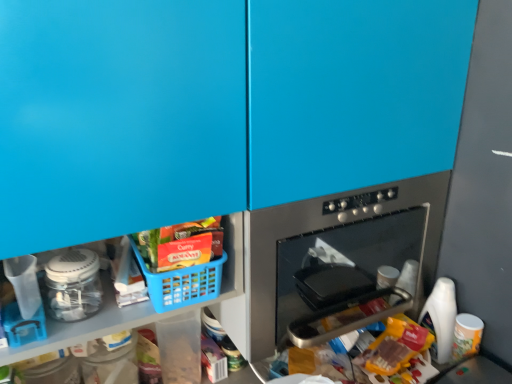
What are the coordinates of `blue plastic basket at lower left` in the screenshot? It's located at [x=181, y=283].

Identify the location of clear plastic jar at lower left. (73, 285).

How much space does translucent plastic bag at lower center, acting as the first food starting from the right, occupy vertically?

translucent plastic bag at lower center, acting as the first food starting from the right, is 24.14 centimeters in height.

Locate an element on the screen. white plastic bottle at lower right is located at coordinates (440, 318).

The height and width of the screenshot is (384, 512). What are the coordinates of `matte plastic basket at lower center, which appears as the second food when ordered from the bottom` in the screenshot? It's located at point(181,244).

What do you see at coordinates (338, 245) in the screenshot? This screenshot has height=384, width=512. I see `stainless steel oven at center` at bounding box center [338, 245].

Locate an element on the screen. Image resolution: width=512 pixels, height=384 pixels. blue plastic basket at lower left is located at coordinates (181, 283).

Between clear plastic jar at lower left and stainless steel oven at center, which one is positioned behind?

stainless steel oven at center is further away from the camera.

From the image's perspective, is clear plastic jar at lower left on top of stainless steel oven at center?

No, from the image's perspective, clear plastic jar at lower left is not on top of stainless steel oven at center.

Between clear plastic jar at lower left and stainless steel oven at center, which one has larger size?

Bigger between the two is stainless steel oven at center.

Would you say clear plastic jar at lower left is to the left or to the right of stainless steel oven at center in the picture?

In the image, clear plastic jar at lower left appears on the left side of stainless steel oven at center.

Is point (67, 286) in front of point (370, 347)?

Yes, it is.

Would you say clear plastic jar at lower left is outside translucent plastic bag at lower center, the 2th food viewed from the left?

Yes, clear plastic jar at lower left is not within translucent plastic bag at lower center, the 2th food viewed from the left.

Is clear plastic jar at lower left positioned with its back to translucent plastic bag at lower center, the 2th food viewed from the left?

No, clear plastic jar at lower left's orientation is not away from translucent plastic bag at lower center, the 2th food viewed from the left.

Which of these two, clear plastic jar at lower left or translucent plastic bag at lower center, the 2th food viewed from the left, stands shorter?

With less height is clear plastic jar at lower left.

Which of these two, stainless steel oven at center or translucent plastic bag at lower center, acting as the first food starting from the right, stands shorter?

With less height is translucent plastic bag at lower center, acting as the first food starting from the right.

How different are the orientations of stainless steel oven at center and translucent plastic bag at lower center, arranged as the first food when ordered from the bottom, in degrees?

They differ by 0.785 degrees in their facing directions.

Which is in front, stainless steel oven at center or translucent plastic bag at lower center, acting as the first food starting from the right?

Positioned in front is translucent plastic bag at lower center, acting as the first food starting from the right.

From a real-world perspective, is matte plastic basket at lower center, positioned as the first food in top-to-bottom order, physically located above or below stainless steel oven at center?

matte plastic basket at lower center, positioned as the first food in top-to-bottom order, is above stainless steel oven at center.

Do you think matte plastic basket at lower center, placed as the second food when sorted from right to left, is within stainless steel oven at center, or outside of it?

The correct answer is: outside.

Is point (168, 232) positioned before point (367, 203)?

Yes.

Considering the sizes of objects matte plastic basket at lower center, which ranks as the first food in left-to-right order, and stainless steel oven at center in the image provided, who is smaller, matte plastic basket at lower center, which ranks as the first food in left-to-right order, or stainless steel oven at center?

Smaller between the two is matte plastic basket at lower center, which ranks as the first food in left-to-right order.

Does translucent plastic bag at lower center, acting as the first food starting from the right, have a lesser width compared to stainless steel oven at center?

Correct, the width of translucent plastic bag at lower center, acting as the first food starting from the right, is less than that of stainless steel oven at center.

Looking at this image, from the image's perspective, which is below, translucent plastic bag at lower center, the 2th food viewed from the left, or stainless steel oven at center?

translucent plastic bag at lower center, the 2th food viewed from the left, appears lower in the image.

How many degrees apart are the facing directions of translucent plastic bag at lower center, acting as the first food starting from the right, and stainless steel oven at center?

The angular difference between translucent plastic bag at lower center, acting as the first food starting from the right, and stainless steel oven at center is 0.785 degrees.

How different are the orientations of translucent plastic bag at lower center, arranged as the first food when ordered from the bottom, and matte plastic basket at lower center, positioned as the first food in top-to-bottom order, in degrees?

The angular difference between translucent plastic bag at lower center, arranged as the first food when ordered from the bottom, and matte plastic basket at lower center, positioned as the first food in top-to-bottom order, is 3.89 degrees.

Between translucent plastic bag at lower center, arranged as the first food when ordered from the bottom, and matte plastic basket at lower center, placed as the second food when sorted from right to left, which one has more height?

translucent plastic bag at lower center, arranged as the first food when ordered from the bottom.

How distant is translucent plastic bag at lower center, acting as the first food starting from the right, from matte plastic basket at lower center, placed as the second food when sorted from right to left?

The distance of translucent plastic bag at lower center, acting as the first food starting from the right, from matte plastic basket at lower center, placed as the second food when sorted from right to left, is 21.65 inches.

The image size is (512, 384). What are the coordinates of `food on the left of the translucent plastic bag at lower center, arranged as the first food when ordered from the bottom` in the screenshot? It's located at (181, 244).

Considering the positions of points (436, 284) and (178, 297), is point (436, 284) closer to camera compared to point (178, 297)?

That is False.

Is blue plastic basket at lower left surrounded by white plastic bottle at lower right?

No, blue plastic basket at lower left is not a part of white plastic bottle at lower right.

Between white plastic bottle at lower right and blue plastic basket at lower left, which one is positioned in front?

blue plastic basket at lower left is closer to the camera.

Is white plastic bottle at lower right thinner than blue plastic basket at lower left?

Yes.

Where is `home appliance on the right of clear plastic jar at lower left`? home appliance on the right of clear plastic jar at lower left is located at coordinates (338, 245).

At what (x,y) coordinates should I click in order to perform the action: click on appliance to the left of translucent plastic bag at lower center, the second food in the top-to-bottom sequence. Please return your answer as a coordinate pair (x, y). The width and height of the screenshot is (512, 384). Looking at the image, I should click on (73, 285).

From the image, which object appears to be nearer to stainless steel oven at center, clear plastic jar at lower left or blue plastic basket at lower left?

Among the two, blue plastic basket at lower left is located nearer to stainless steel oven at center.

Based on their spatial positions, is clear plastic jar at lower left or blue plastic basket at lower left closer to white plastic bottle at lower right?

blue plastic basket at lower left.

Looking at the image, which one is located further to translucent plastic bag at lower center, acting as the first food starting from the right, matte plastic basket at lower center, positioned as the first food in top-to-bottom order, or stainless steel oven at center?

The object further to translucent plastic bag at lower center, acting as the first food starting from the right, is matte plastic basket at lower center, positioned as the first food in top-to-bottom order.

In the scene shown: Based on their spatial positions, is matte plastic basket at lower center, which appears as the second food when ordered from the bottom, or blue plastic basket at lower left closer to clear plastic jar at lower left?

blue plastic basket at lower left is positioned closer to the anchor clear plastic jar at lower left.

Considering their positions, is clear plastic jar at lower left positioned further to translucent plastic bag at lower center, the 2th food viewed from the left, than blue plastic basket at lower left?

clear plastic jar at lower left is positioned further to the anchor translucent plastic bag at lower center, the 2th food viewed from the left.

Looking at the image, which one is located further to clear plastic jar at lower left, stainless steel oven at center or translucent plastic bag at lower center, the second food in the top-to-bottom sequence?

stainless steel oven at center lies further to clear plastic jar at lower left than the other object.

When comparing their distances from white plastic bottle at lower right, does blue plastic basket at lower left or clear plastic jar at lower left seem closer?

blue plastic basket at lower left lies closer to white plastic bottle at lower right than the other object.

From the image, which object appears to be nearer to clear plastic jar at lower left, white plastic bottle at lower right or translucent plastic bag at lower center, the 2th food viewed from the left?

Based on the image, translucent plastic bag at lower center, the 2th food viewed from the left, appears to be nearer to clear plastic jar at lower left.

Where is `basket that lies between matte plastic basket at lower center, positioned as the first food in top-to-bottom order, and translucent plastic bag at lower center, acting as the first food starting from the right, from top to bottom`? The image size is (512, 384). basket that lies between matte plastic basket at lower center, positioned as the first food in top-to-bottom order, and translucent plastic bag at lower center, acting as the first food starting from the right, from top to bottom is located at coordinates (181, 283).

Identify the location of home appliance located between blue plastic basket at lower left and white plastic bottle at lower right in the left-right direction. The width and height of the screenshot is (512, 384). (338, 245).

At what (x,y) coordinates should I click in order to perform the action: click on home appliance between translucent plastic bag at lower center, acting as the first food starting from the right, and white plastic bottle at lower right from front to back. Please return your answer as a coordinate pair (x, y). Looking at the image, I should click on (338, 245).

Where is `home appliance located between clear plastic jar at lower left and white plastic bottle at lower right in the left-right direction`? The width and height of the screenshot is (512, 384). home appliance located between clear plastic jar at lower left and white plastic bottle at lower right in the left-right direction is located at coordinates (338, 245).